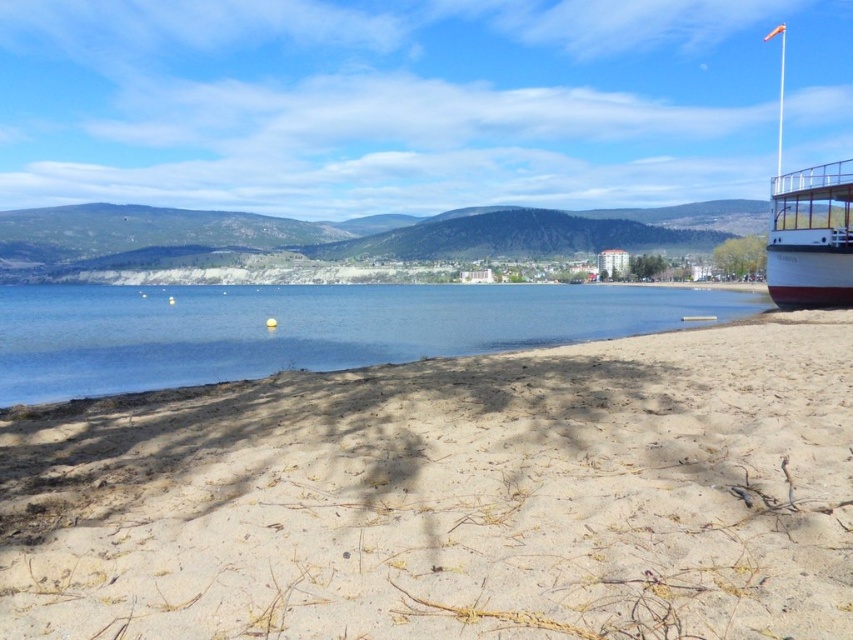
You are planning to set up a picnic area on the light brown sandy beach at lower center. You have a picnic blanket that is 2 meters wide. Can the white polished wood boat at right be placed next to the picnic blanket without overlapping?

The light brown sandy beach at lower center might be wider than white polished wood boat at right, so there is a possibility that the beach is wide enough to accommodate both the picnic blanket and the boat without overlapping. However, the exact width of the beach and the boat are not specified, so it is uncertain.

From the picture: You are planning to take a photo of the clear blue water at center and the white polished wood boat at right. Which object should you focus on first if you want to capture both in a single frame without moving the camera?

The clear blue water at center is larger in size than the white polished wood boat at right, so you should focus on the clear blue water at center first to ensure it fills the frame appropriately before adjusting for the boat.